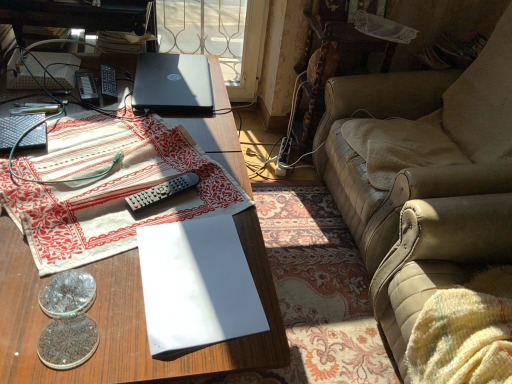
Locate an element on the screen. vacant space that's between satin black laptop at upper center and white paper at center, which appears as the first paperback book when ordered from the bottom is located at coordinates (190, 162).